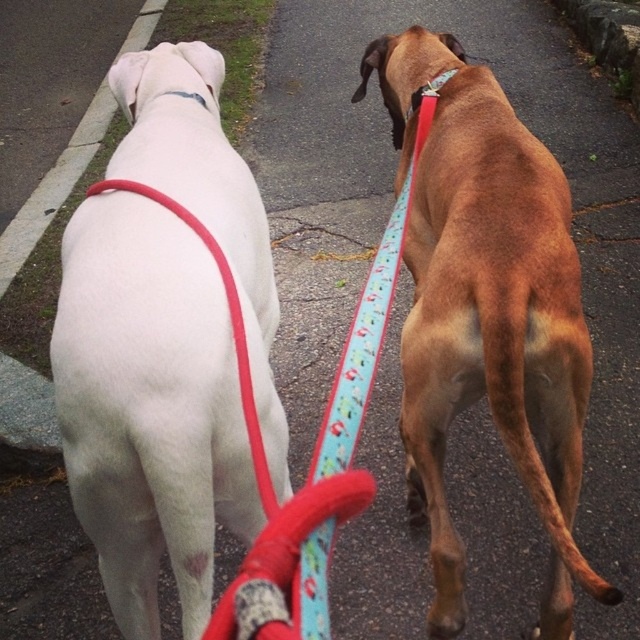
Question: Which is nearer to the matte red collar at upper center?

Choices:
 (A) white fabric neckband at upper center
 (B) white matte dog at left

Answer: (A)

Question: Which of these objects is positioned farthest from the brown matte dog at center?

Choices:
 (A) white matte dog at left
 (B) blue fabric leash at center

Answer: (A)

Question: Is white matte dog at left smaller than blue fabric leash at center?

Choices:
 (A) no
 (B) yes

Answer: (B)

Question: Which object is positioned farthest from the blue fabric leash at center?

Choices:
 (A) brown matte dog at center
 (B) white fabric neckband at upper center
 (C) matte red collar at upper center

Answer: (B)

Question: Can you confirm if brown matte dog at center is wider than white fabric neckband at upper center?

Choices:
 (A) yes
 (B) no

Answer: (A)

Question: Does brown matte dog at center have a greater width compared to matte red collar at upper center?

Choices:
 (A) no
 (B) yes

Answer: (B)